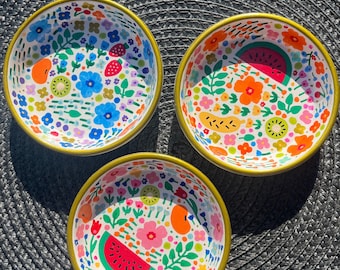
Find the location of a particular element. bottom bowl is located at coordinates [168, 230].